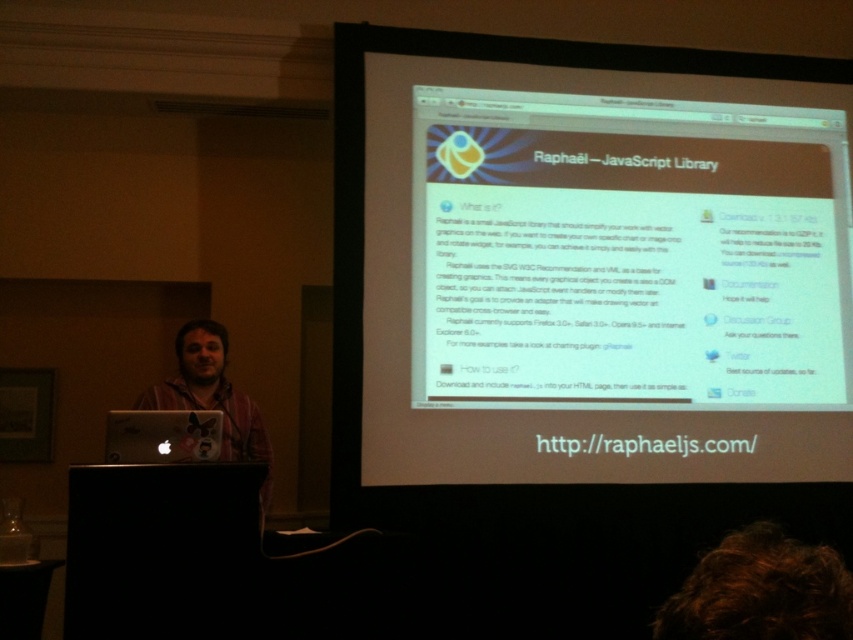
In the scene shown: Is brown hair at lower right taller than matte black laptop at left?

No, brown hair at lower right is not taller than matte black laptop at left.

Between brown hair at lower right and matte black laptop at left, which one is positioned lower?

brown hair at lower right is lower down.

Which is behind, point (805, 554) or point (221, 458)?

Point (221, 458)

Where is `brown hair at lower right`? The width and height of the screenshot is (853, 640). brown hair at lower right is located at coordinates (759, 592).

The width and height of the screenshot is (853, 640). In order to click on brown hair at lower right in this screenshot , I will do `click(759, 592)`.

From the picture: Is brown hair at lower right below matte gold laptop at center?

Yes, brown hair at lower right is below matte gold laptop at center.

The image size is (853, 640). I want to click on brown hair at lower right, so click(759, 592).

Which is below, white glossy computer screen at center or matte gold laptop at center?

Positioned lower is matte gold laptop at center.

What do you see at coordinates (589, 280) in the screenshot?
I see `white glossy computer screen at center` at bounding box center [589, 280].

This screenshot has height=640, width=853. Identify the location of white glossy computer screen at center. (589, 280).